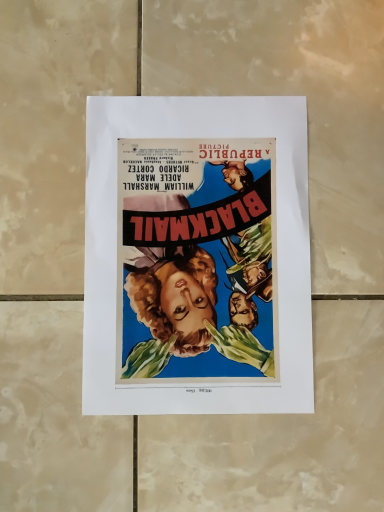
Describe the element at coordinates (197, 256) in the screenshot. I see `vivid paper poster at center` at that location.

Measure the distance between point (x=257, y=249) and camera.

Point (x=257, y=249) and camera are 15.67 inches apart from each other.

In order to face vivid paper poster at center, should I rotate leftwards or rightwards?

You should rotate right by 0.855 degrees.

You are a GUI agent. You are given a task and a screenshot of the screen. Output one action in this format:
    pyautogui.click(x=<x>, y=<y>)
    Task: Click on the vivid paper poster at center
    
    Given the screenshot: What is the action you would take?
    pyautogui.click(x=197, y=256)

Identify the location of vivid paper poster at center. This screenshot has width=384, height=512. (197, 256).